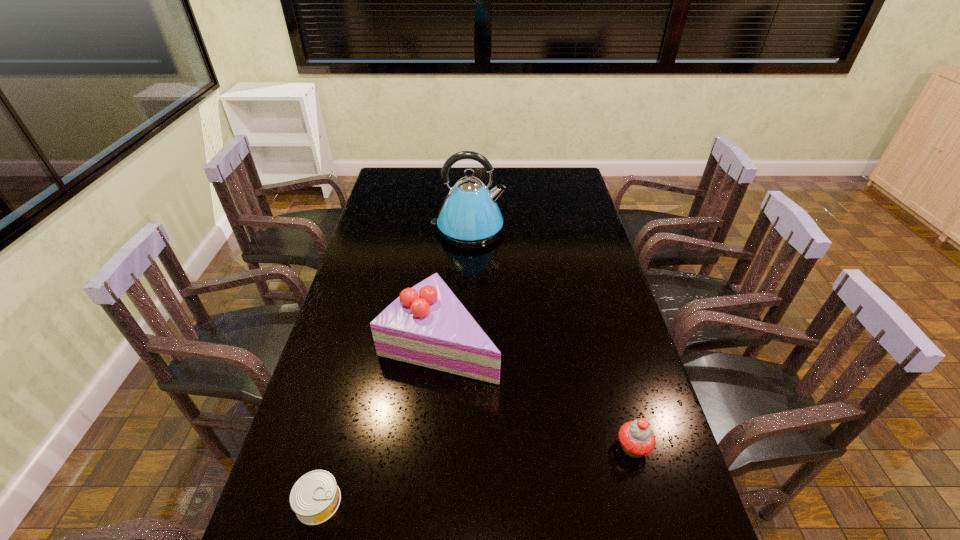
What are the coordinates of `kettle` in the screenshot? It's located at (469, 215).

Locate an element on the screen. the tallest object is located at coordinates (469, 215).

Image resolution: width=960 pixels, height=540 pixels. What are the coordinates of `the second farthest object` in the screenshot? It's located at (427, 325).

I want to click on the second tallest object, so click(427, 325).

What are the coordinates of `the second shortest object` in the screenshot? It's located at (637, 439).

Locate an element on the screen. This screenshot has width=960, height=540. the third farthest object is located at coordinates (637, 439).

Identify the location of the leftmost object. Image resolution: width=960 pixels, height=540 pixels. (315, 497).

Image resolution: width=960 pixels, height=540 pixels. I want to click on the nearest object, so click(x=315, y=497).

At what (x,y) coordinates should I click in order to perform the action: click on free space located 0.170m at the spout of the farthest object. Please return your answer as a coordinate pair (x, y). The image size is (960, 540). Looking at the image, I should click on (547, 229).

Where is `vacant space located on the right of the third nearest object`? vacant space located on the right of the third nearest object is located at coordinates (585, 341).